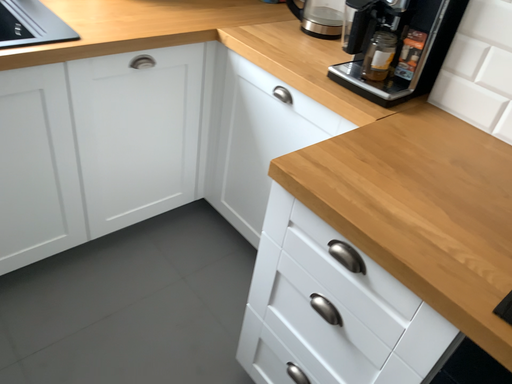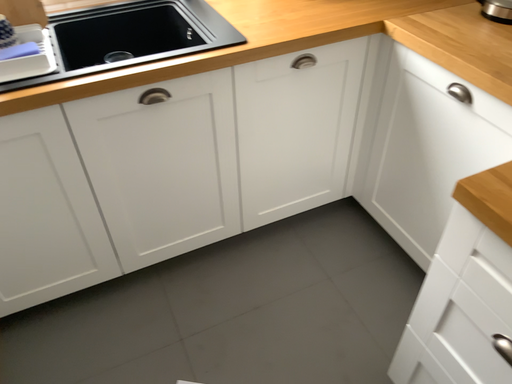
Question: Which way did the camera rotate in the video?

Choices:
 (A) rotated right
 (B) rotated left

Answer: (B)